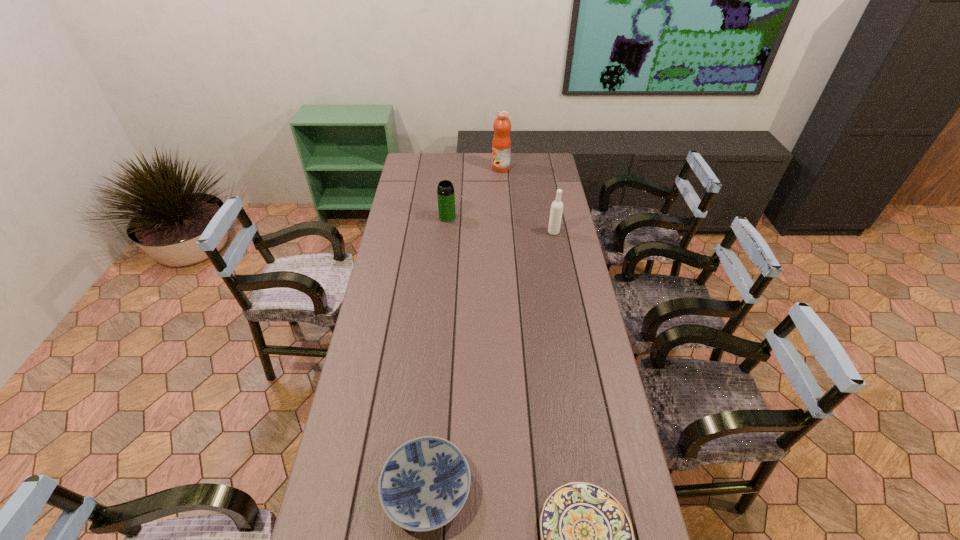
Identify the location of free space between the fruit juice and the thermos bottle. (474, 193).

Where is `vacant area between the tallest object and the third nearest object`? vacant area between the tallest object and the third nearest object is located at coordinates (527, 200).

Where is `empty location between the thermos bottle and the taller plate`? empty location between the thermos bottle and the taller plate is located at coordinates 437,354.

The width and height of the screenshot is (960, 540). In order to click on vacant area that lies between the fruit juice and the second farthest object in this screenshot , I will do `click(474, 193)`.

The height and width of the screenshot is (540, 960). Identify the location of object that is the closest to the vodka. (445, 193).

Locate which object is the fourth closest to the third farthest object. Please provide its 2D coordinates. Your answer should be formatted as a tuple, i.e. [(x, y)], where the tuple contains the x and y coordinates of a point satisfying the conditions above.

[(587, 539)]

This screenshot has width=960, height=540. I want to click on free space that satisfies the following two spatial constraints: 1. from the spout of the fourth nearest object; 2. on the right side of the vodka, so click(x=446, y=232).

Where is `free location that satisfies the following two spatial constraints: 1. from the spout of the third farthest object; 2. on the left side of the second farthest object`? free location that satisfies the following two spatial constraints: 1. from the spout of the third farthest object; 2. on the left side of the second farthest object is located at coordinates (446, 232).

Find the location of a particular element. The height and width of the screenshot is (540, 960). vacant space that satisfies the following two spatial constraints: 1. on the front label of the vodka; 2. on the right side of the tallest object is located at coordinates (505, 232).

You are a GUI agent. You are given a task and a screenshot of the screen. Output one action in this format:
    pyautogui.click(x=<x>, y=<y>)
    Task: Click on the vacant region that satisfies the following two spatial constraints: 1. on the front label of the fruit juice; 2. from the spout of the second farthest object
    Image resolution: width=960 pixels, height=540 pixels.
    Given the screenshot: What is the action you would take?
    pyautogui.click(x=504, y=217)